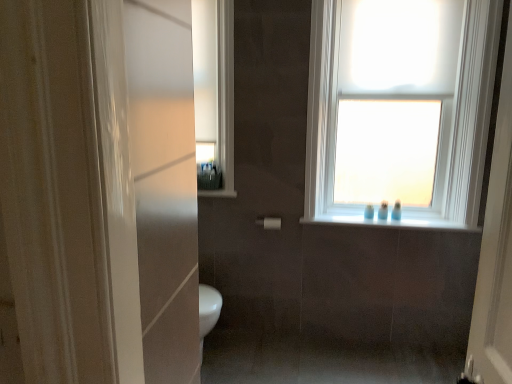
Locate an element on the screen. This screenshot has width=512, height=384. vacant space situated above white glossy window sill at upper center, which is the second window sill from left to right (from a real-world perspective) is located at coordinates (388, 217).